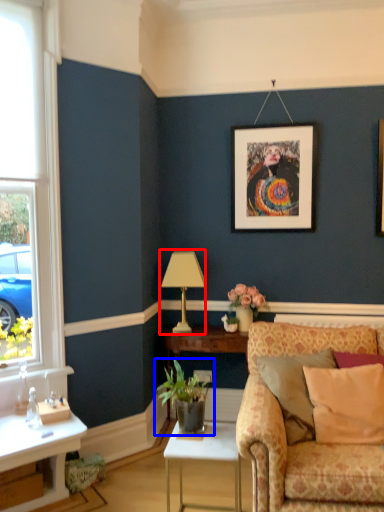
Question: Among these objects, which one is nearest to the camera, table lamp (highlighted by a red box) or houseplant (highlighted by a blue box)?

Choices:
 (A) table lamp
 (B) houseplant

Answer: (B)